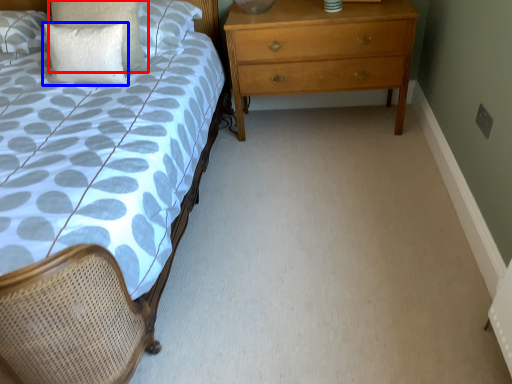
Question: Which of the following is the closest to the observer, pillow (highlighted by a red box) or pillow (highlighted by a blue box)?

Choices:
 (A) pillow
 (B) pillow

Answer: (B)